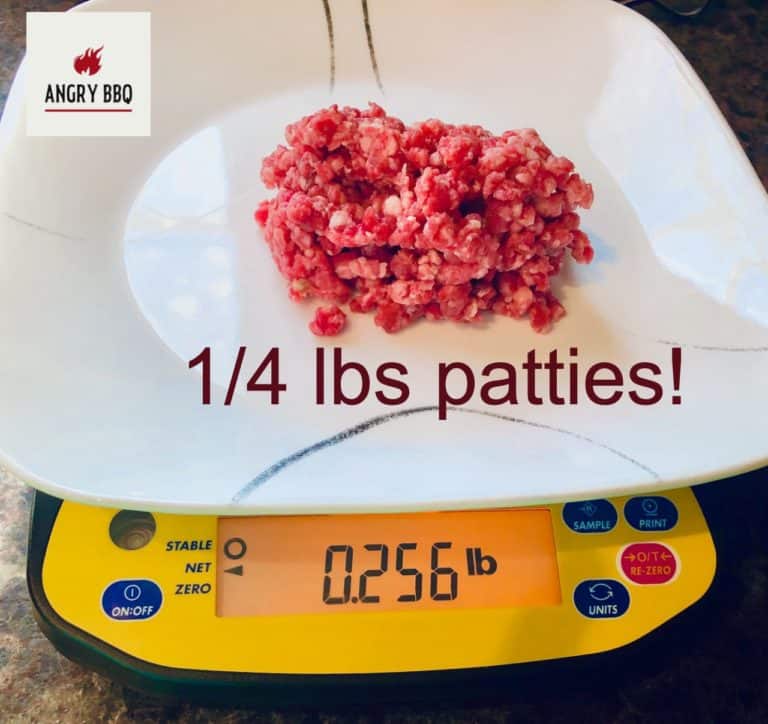
Where is `white plate`? white plate is located at coordinates (28, 277).